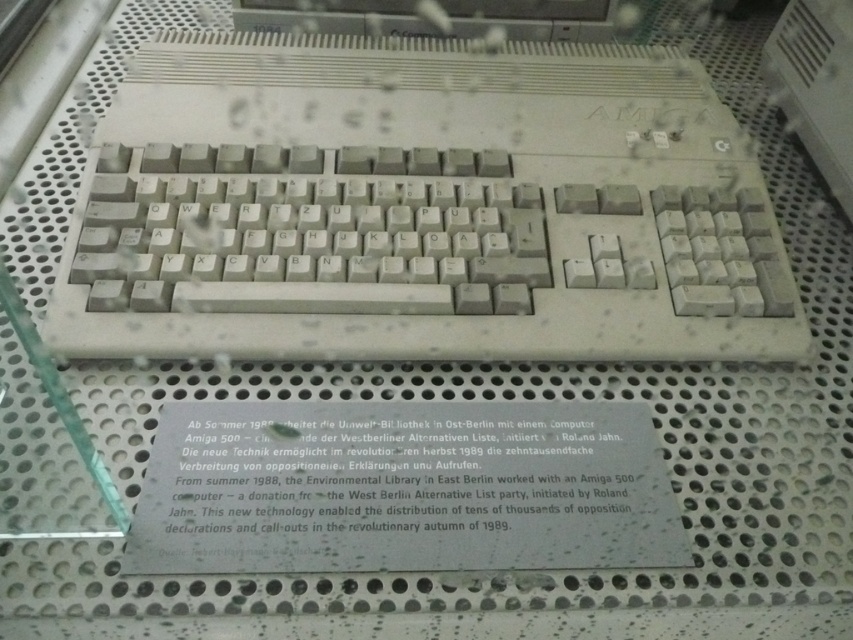
Question: Among these objects, which one is farthest from the camera?

Choices:
 (A) white plastic monitor at upper center
 (B) beige plastic keyboard at center

Answer: (A)

Question: Which point is closer to the camera?

Choices:
 (A) (840, 99)
 (B) (616, 140)

Answer: (B)

Question: Among these objects, which one is nearest to the camera?

Choices:
 (A) white plastic monitor at upper center
 (B) white plastic keyboard at upper right
 (C) beige plastic keyboard at center

Answer: (C)

Question: Does beige plastic keyboard at center appear over white plastic keyboard at upper right?

Choices:
 (A) no
 (B) yes

Answer: (A)

Question: Is beige plastic keyboard at center thinner than white plastic monitor at upper center?

Choices:
 (A) yes
 (B) no

Answer: (B)

Question: Where is beige plastic keyboard at center located in relation to white plastic monitor at upper center in the image?

Choices:
 (A) above
 (B) below

Answer: (B)